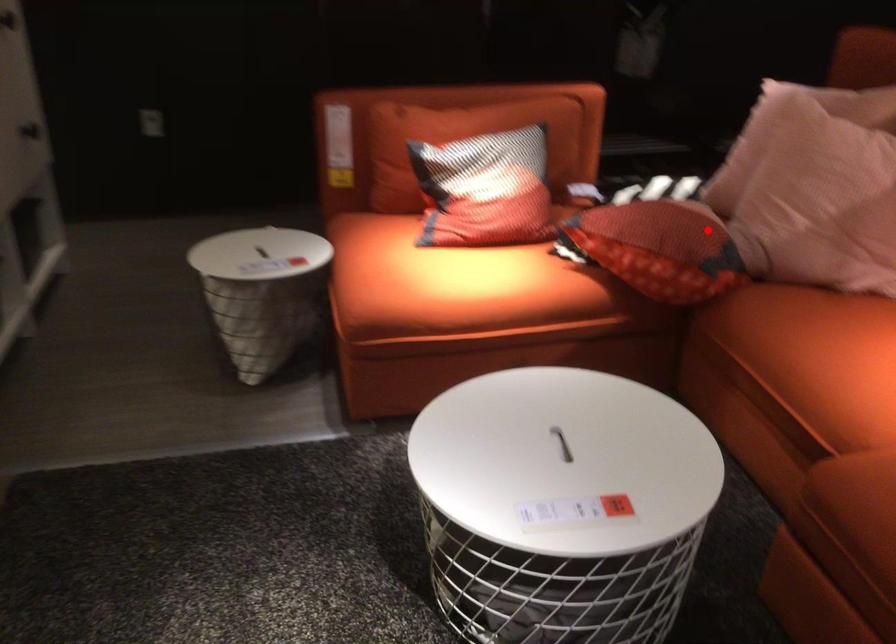
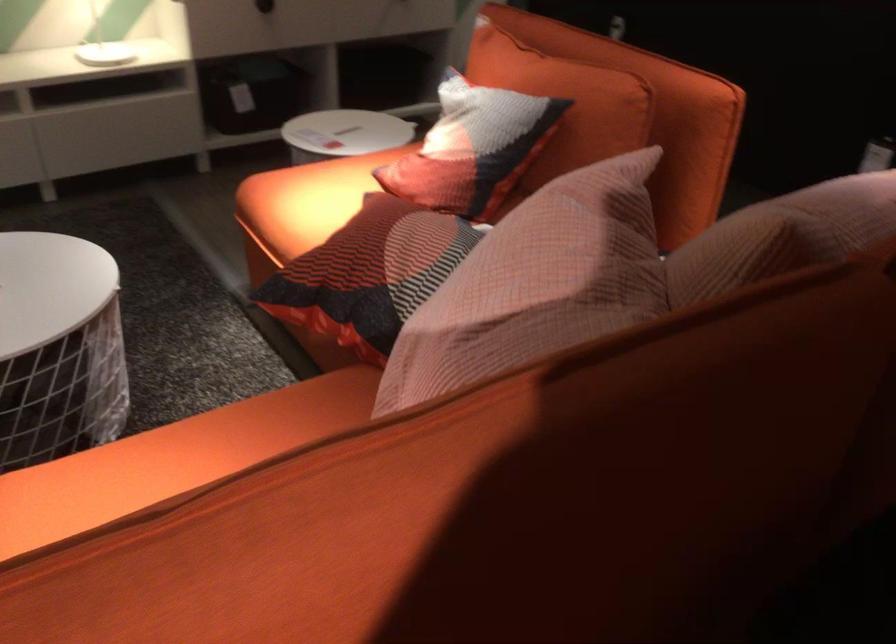
Question: I am providing you with two images of the same scene from different viewpoints. Image1 has a red point marked. In image2, the corresponding 3D location appears at what relative position? Reply with the corresponding letter.

Choices:
 (A) Closer
 (B) Farther

Answer: (A)